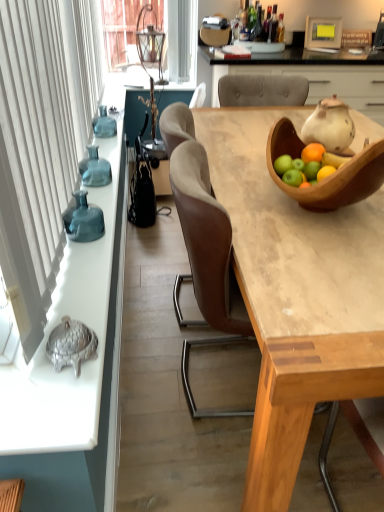
You are a GUI agent. You are given a task and a screenshot of the screen. Output one action in this format:
    pyautogui.click(x=<x>, y=<y>)
    Task: Click on the free space to the left of wooden bowl at upper right
    Image resolution: width=384 pixels, height=512 pixels.
    Given the screenshot: What is the action you would take?
    pyautogui.click(x=250, y=207)